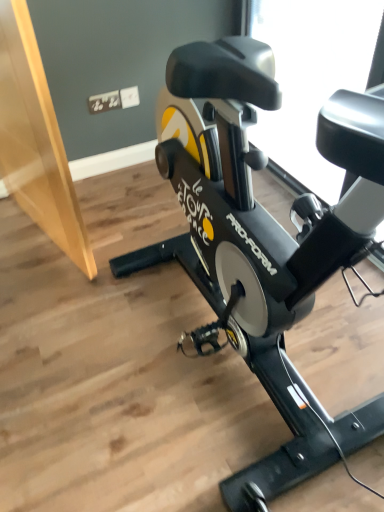
Describe the element at coordinates (262, 242) in the screenshot. I see `black matte stationary bicycle at center` at that location.

The image size is (384, 512). In order to click on black matte stationary bicycle at center in this screenshot , I will do `click(262, 242)`.

Image resolution: width=384 pixels, height=512 pixels. What are the coordinates of `transparent glass window at upper center` in the screenshot? It's located at (312, 78).

This screenshot has height=512, width=384. What do you see at coordinates (312, 78) in the screenshot?
I see `transparent glass window at upper center` at bounding box center [312, 78].

Where is `black matte stationary bicycle at center`? The height and width of the screenshot is (512, 384). black matte stationary bicycle at center is located at coordinates (262, 242).

Does black matte stationary bicycle at center appear on the left side of transparent glass window at upper center?

Indeed, black matte stationary bicycle at center is positioned on the left side of transparent glass window at upper center.

Does black matte stationary bicycle at center lie in front of transparent glass window at upper center?

Yes, black matte stationary bicycle at center is in front of transparent glass window at upper center.

Does point (240, 147) appear closer or farther from the camera than point (256, 29)?

Point (240, 147) is closer to the camera than point (256, 29).

From the image's perspective, which is below, black matte stationary bicycle at center or transparent glass window at upper center?

black matte stationary bicycle at center appears lower in the image.

From a real-world perspective, is black matte stationary bicycle at center located higher than transparent glass window at upper center?

Yes, from a real-world perspective, black matte stationary bicycle at center is above transparent glass window at upper center.

Which of these two, black matte stationary bicycle at center or transparent glass window at upper center, is wider?

black matte stationary bicycle at center.

From their relative heights in the image, would you say black matte stationary bicycle at center is taller or shorter than transparent glass window at upper center?

In the image, black matte stationary bicycle at center appears to be taller than transparent glass window at upper center.

Who is bigger, black matte stationary bicycle at center or transparent glass window at upper center?

black matte stationary bicycle at center.

Can transparent glass window at upper center be found inside black matte stationary bicycle at center?

No, transparent glass window at upper center is not surrounded by black matte stationary bicycle at center.

Can you see black matte stationary bicycle at center touching transparent glass window at upper center?

black matte stationary bicycle at center and transparent glass window at upper center are clearly separated.

Is black matte stationary bicycle at center facing away from transparent glass window at upper center?

Absolutely, black matte stationary bicycle at center is directed away from transparent glass window at upper center.

What's the angular difference between black matte stationary bicycle at center and transparent glass window at upper center's facing directions?

The angular difference between black matte stationary bicycle at center and transparent glass window at upper center is 0.000146 degrees.

How far apart are black matte stationary bicycle at center and transparent glass window at upper center?

black matte stationary bicycle at center and transparent glass window at upper center are 36.78 inches apart from each other.

Where is `window screen that is above the black matte stationary bicycle at center (from the image's perspective)`? The height and width of the screenshot is (512, 384). window screen that is above the black matte stationary bicycle at center (from the image's perspective) is located at coordinates (312, 78).

Consider the image. Is transparent glass window at upper center at the left side of black matte stationary bicycle at center?

In fact, transparent glass window at upper center is to the right of black matte stationary bicycle at center.

Is transparent glass window at upper center in front of black matte stationary bicycle at center?

That is False.

Which is farther from the camera, (x=312, y=189) or (x=308, y=234)?

The point (x=312, y=189) is more distant.

From the image's perspective, relative to black matte stationary bicycle at center, is transparent glass window at upper center above or below?

Based on their image positions, transparent glass window at upper center is located above black matte stationary bicycle at center.

From a real-world perspective, which is physically below, transparent glass window at upper center or black matte stationary bicycle at center?

In real-world perspective, transparent glass window at upper center is lower.

Does transparent glass window at upper center have a greater width compared to black matte stationary bicycle at center?

No.

Who is taller, transparent glass window at upper center or black matte stationary bicycle at center?

black matte stationary bicycle at center.

Is transparent glass window at upper center bigger than black matte stationary bicycle at center?

No, transparent glass window at upper center is not bigger than black matte stationary bicycle at center.

Is transparent glass window at upper center positioned beyond the bounds of black matte stationary bicycle at center?

Yes, transparent glass window at upper center is outside of black matte stationary bicycle at center.

Is transparent glass window at upper center not near black matte stationary bicycle at center?

No, transparent glass window at upper center is not far away from black matte stationary bicycle at center.

Is transparent glass window at upper center looking in the opposite direction of black matte stationary bicycle at center?

No, transparent glass window at upper center is not facing the opposite direction of black matte stationary bicycle at center.

Measure the distance between transparent glass window at upper center and black matte stationary bicycle at center.

36.78 inches.

Where is `stationary bicycle lying in front of the transparent glass window at upper center`? Image resolution: width=384 pixels, height=512 pixels. stationary bicycle lying in front of the transparent glass window at upper center is located at coordinates (262, 242).

The image size is (384, 512). Identify the location of stationary bicycle to the left of transparent glass window at upper center. (262, 242).

What are the coordinates of `stationary bicycle positioned vertically above the transparent glass window at upper center (from a real-world perspective)` in the screenshot? It's located at (262, 242).